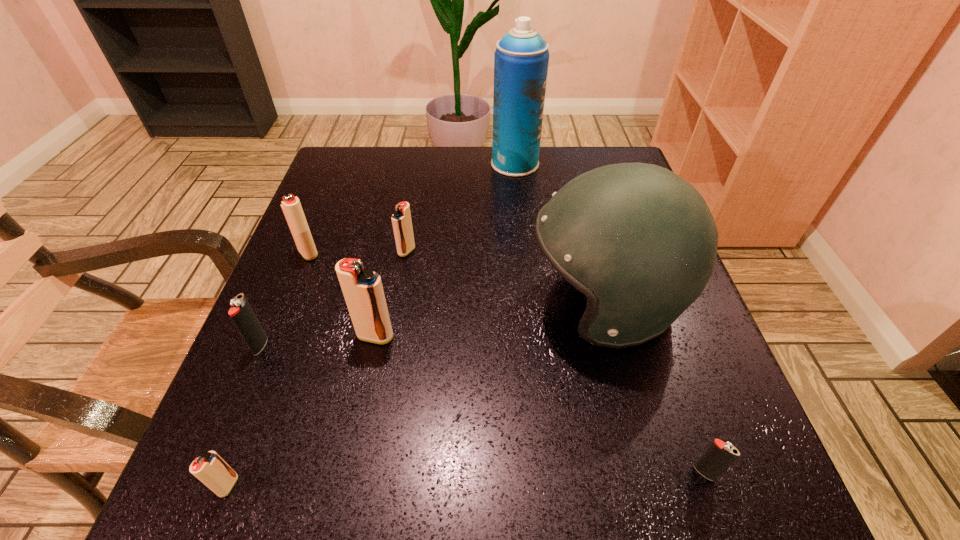
In order to click on free region at the near edge in this screenshot , I will do `click(590, 473)`.

This screenshot has height=540, width=960. In the image, there is a desktop. What are the coordinates of `vacant area at the left edge` in the screenshot? It's located at (294, 448).

Locate an element on the screen. The width and height of the screenshot is (960, 540). vacant region at the far left corner of the desktop is located at coordinates (351, 162).

You are a GUI agent. You are given a task and a screenshot of the screen. Output one action in this format:
    pyautogui.click(x=<x>, y=<y>)
    Task: Click on the vacant region at the far right corner of the desktop
    
    Given the screenshot: What is the action you would take?
    pyautogui.click(x=590, y=170)

Locate an element on the screen. This screenshot has width=960, height=540. vacant space at the near right corner of the desktop is located at coordinates [668, 524].

Locate an element on the screen. This screenshot has width=960, height=540. blank region between the third biggest red igniter and the farther black igniter is located at coordinates (334, 298).

Locate an element on the screen. This screenshot has height=540, width=960. vacant region between the nearer black igniter and the tallest igniter is located at coordinates (540, 404).

The image size is (960, 540). I want to click on empty location between the smallest red igniter and the bigger black igniter, so click(245, 415).

Locate an element on the screen. vacant point located between the football helmet and the rightmost igniter is located at coordinates (654, 388).

At what (x,y) coordinates should I click in order to perform the action: click on vacant space in between the left black igniter and the second tallest igniter. Please return your answer as a coordinate pair (x, y). Image resolution: width=960 pixels, height=540 pixels. Looking at the image, I should click on (284, 299).